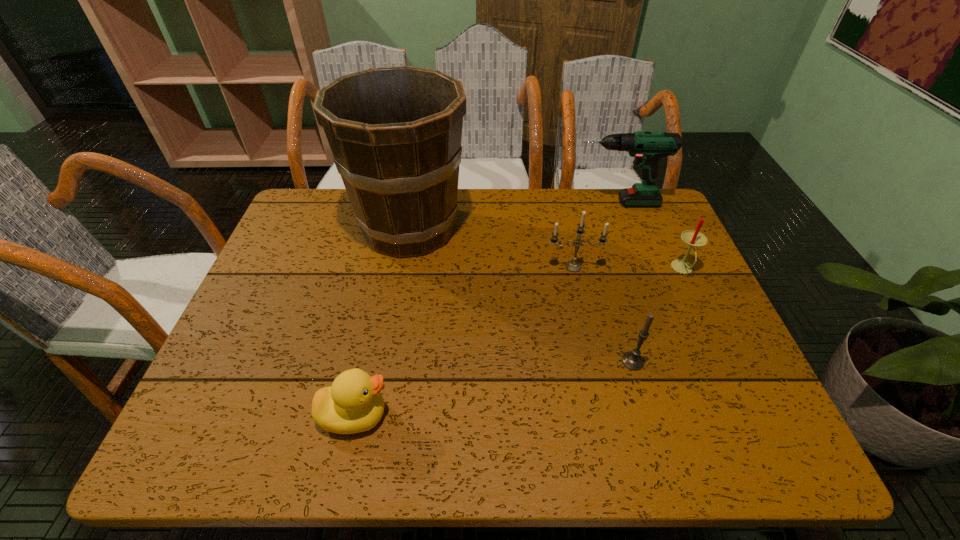
This screenshot has width=960, height=540. I want to click on free point located on the left of the rightmost candle, so click(591, 269).

Find the location of a particular element. The width and height of the screenshot is (960, 540). vacant space located on the right of the second nearest object is located at coordinates click(x=713, y=361).

What are the coordinates of `free spot located 0.220m at the beak of the nearest object` in the screenshot? It's located at pyautogui.click(x=503, y=415).

Identify the location of bucket that is at the far edge. (395, 133).

The image size is (960, 540). In order to click on drill present at the far edge in this screenshot , I will do 648,148.

Find the location of a particular element. The image size is (960, 540). object that is at the near edge is located at coordinates (353, 404).

The height and width of the screenshot is (540, 960). I want to click on drill that is at the right edge, so click(x=648, y=148).

This screenshot has width=960, height=540. I want to click on candle that is at the right edge, so click(693, 238).

Where is `object present at the far right corner`? This screenshot has width=960, height=540. object present at the far right corner is located at coordinates (648, 148).

In the image, there is a desktop. Where is `vacant space at the far edge`? Image resolution: width=960 pixels, height=540 pixels. vacant space at the far edge is located at coordinates (600, 194).